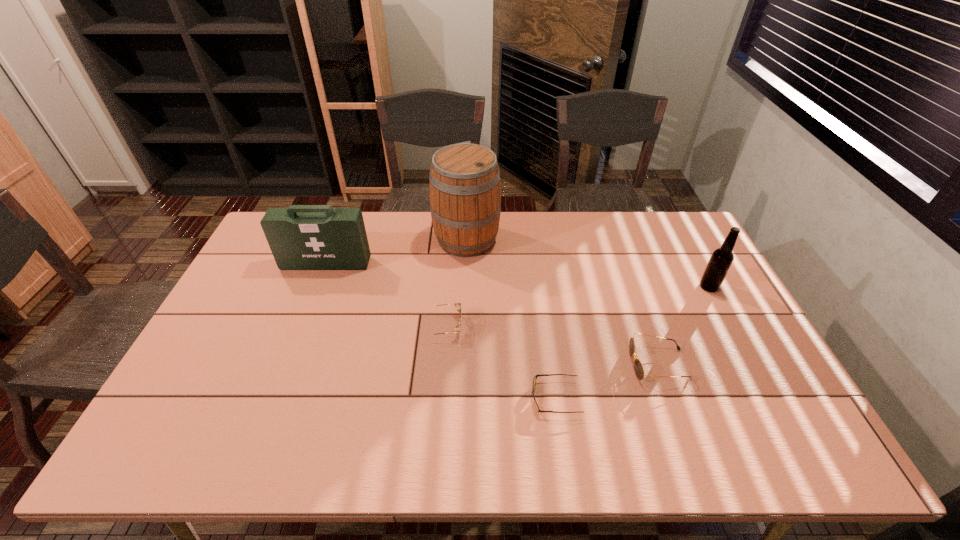
Image resolution: width=960 pixels, height=540 pixels. Identify the location of blank space located on the left of the third farthest object. (602, 287).

Locate an element on the screen. This screenshot has height=540, width=960. free spot located 0.320m on the front-facing side of the leftmost object is located at coordinates (294, 347).

You are a GUI agent. You are given a task and a screenshot of the screen. Output one action in this format:
    pyautogui.click(x=<x>, y=<y>)
    Task: Click on the vacant space located 0.310m on the front lenses of the fourth farthest object
    
    Given the screenshot: What is the action you would take?
    pyautogui.click(x=567, y=326)

The image size is (960, 540). Identify the location of free region located on the lenses of the rightmost sunglasses. (494, 364).

Find the location of a particular element. vacant region located on the lenses of the rightmost sunglasses is located at coordinates (516, 364).

Identify the location of vacant space located on the lenses of the rightmost sunglasses. (509, 364).

The image size is (960, 540). Identify the location of vacant area situated 0.110m on the front-facing side of the shortest sunglasses. (488, 398).

I want to click on blank area located 0.330m on the front-facing side of the shortest sunglasses, so click(400, 398).

This screenshot has height=540, width=960. I want to click on vacant region located on the front-facing side of the shortest sunglasses, so click(x=460, y=398).

I want to click on object at the far edge, so click(464, 184).